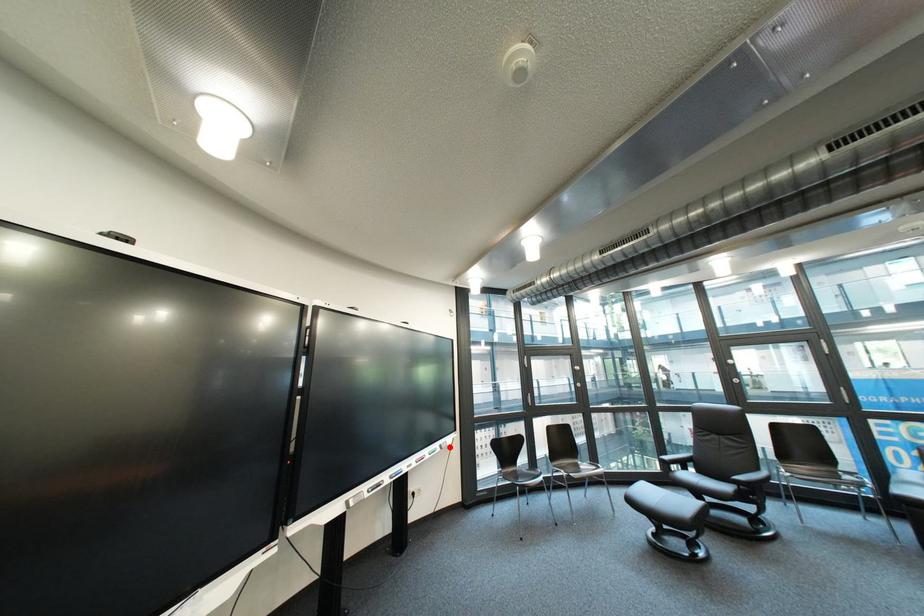
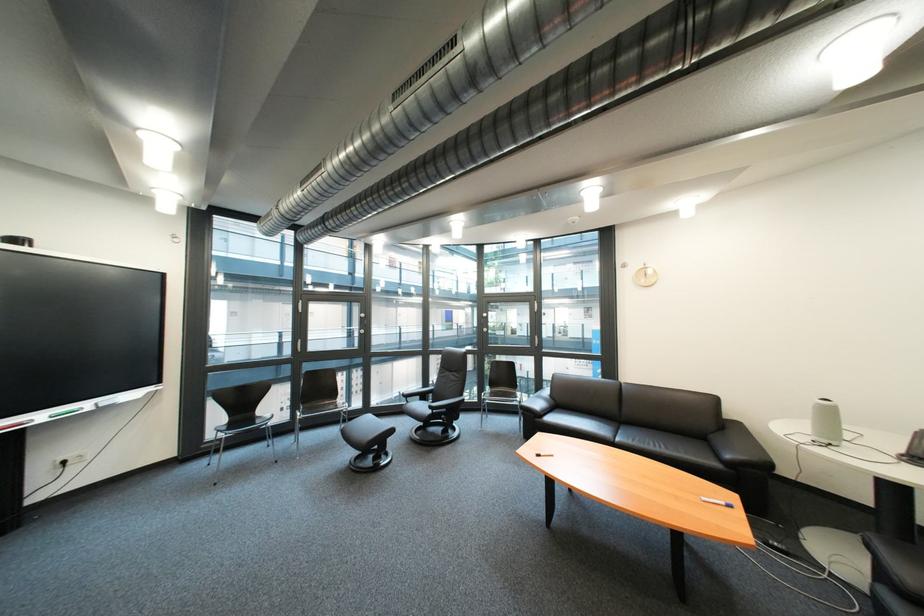
The point at the highlighted location is marked in the first image. Where is the corresponding point in the second image?

(101, 406)